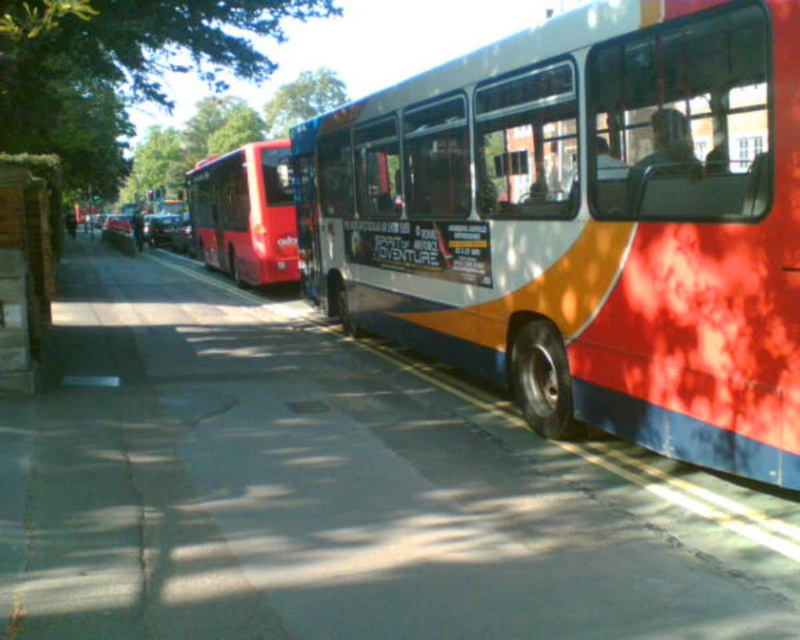
Between green leafy tree at upper center and wooden post at left, which one has more height?

green leafy tree at upper center

Which is in front, point (130, 168) or point (28, 220)?

Point (28, 220) is in front.

Does point (226, 120) lie in front of point (50, 252)?

No.

Where is `green leafy tree at upper center`? This screenshot has height=640, width=800. green leafy tree at upper center is located at coordinates (224, 131).

What are the coordinates of `green leafy tree at upper left` in the screenshot? It's located at (118, 68).

Does green leafy tree at upper left have a lesser width compared to shiny red bus at center?

No, green leafy tree at upper left is not thinner than shiny red bus at center.

Is point (66, 83) less distant than point (196, 204)?

Yes.

Locate an element on the screen. green leafy tree at upper left is located at coordinates (118, 68).

Can you confirm if shiny red bus at center is thinner than wooden post at left?

No.

Is shiny red bus at center positioned in front of wooden post at left?

No.

Who is more distant from viewer, (189, 196) or (44, 292)?

Positioned behind is point (189, 196).

Where is `shiny red bus at center`? shiny red bus at center is located at coordinates (245, 212).